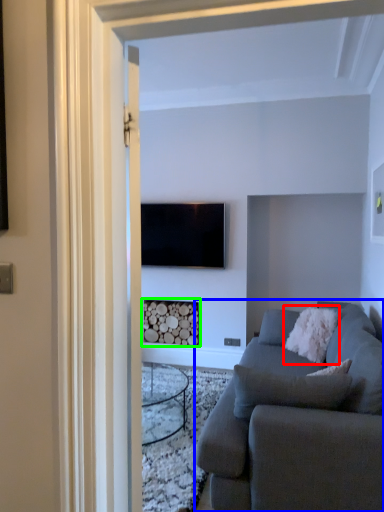
Question: Which is nearer to the pillow (highlighted by a red box)? studio couch (highlighted by a blue box) or fireplace (highlighted by a green box).

Choices:
 (A) studio couch
 (B) fireplace

Answer: (A)